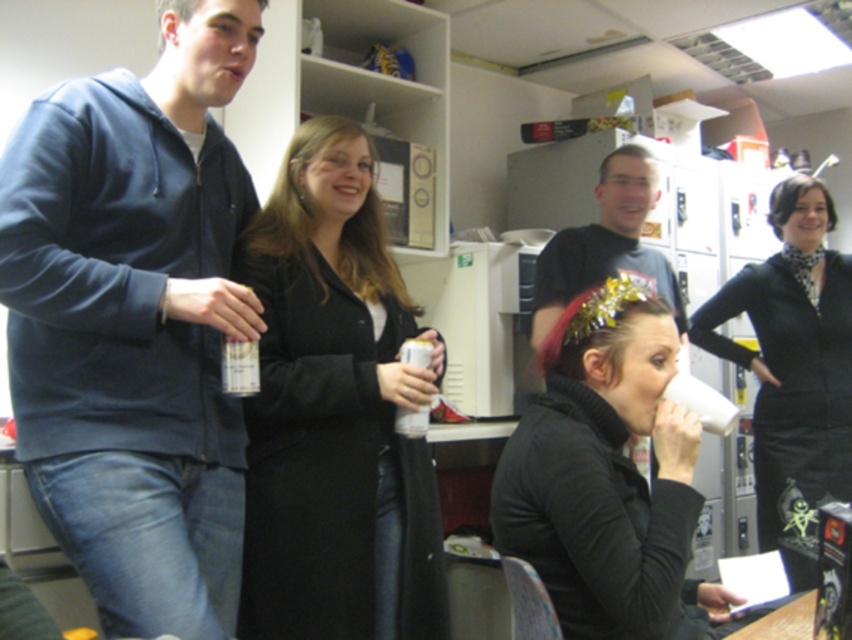
You are planning to place a small plant pot on the table where the woman with the white cup is sitting. Considering the current arrangement, will the matte black coat at center interfere with placing the pot there?

The matte black coat at center is located at point (x=335, y=412), which is not on the table where the woman is seated. Therefore, placing the plant pot there should not be affected by the coat.